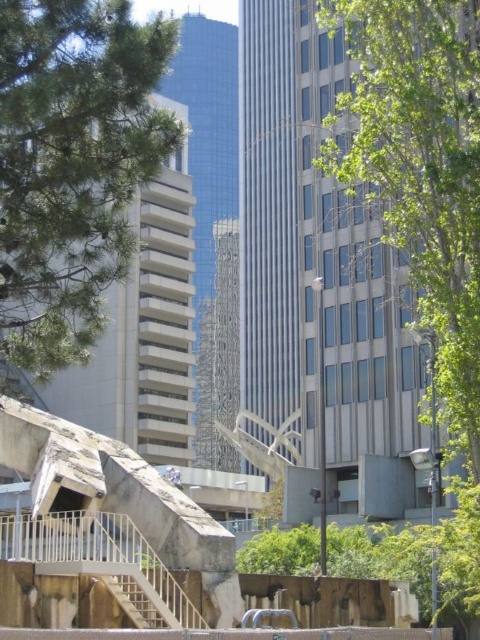
You are a city planner reviewing this urban landscape. You need to determine if the green leafy tree at center can be moved closer to the brown wooden stairs at lower left without blocking the stairs. Can you confirm if the tree is larger than the stairs?

The green leafy tree at center is bigger than brown wooden stairs at lower left, so moving it closer might block the stairs due to its larger size.

You are a visitor trying to find the entrance to the plaza. You see a green leafy tree at left and brown wooden stairs at lower left. Which object is closer to the entrance of the plaza?

The brown wooden stairs at lower left are closer to the entrance of the plaza since they are located at the lower left, which is typically where entrances are positioned in such structures.

You are a city planner assessing the urban space. You need to determine if the green leafy tree at left will fit in a designated area that can accommodate objects up to the width of the brown wooden stairs at lower left. Based on the image, what is your assessment?

The green leafy tree at left might be wider than brown wooden stairs at lower left, so it may not fit within the designated area designed for the stairs width.